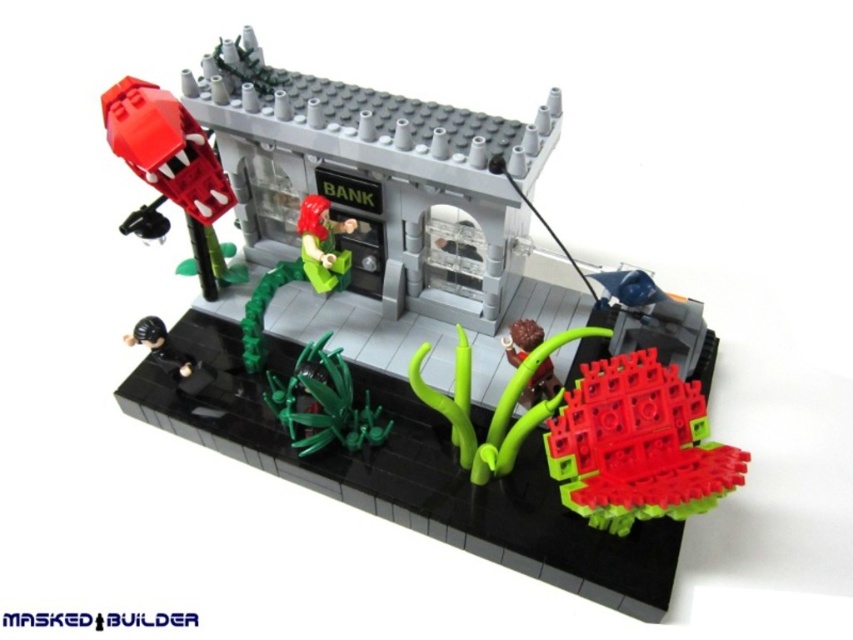
Question: Which object is farther from the camera taking this photo?

Choices:
 (A) matte red robot at upper left
 (B) translucent red plastic plant at lower right
 (C) green matte figure at center

Answer: (C)

Question: Is translucent red plastic plant at lower right smaller than green matte figure at center?

Choices:
 (A) yes
 (B) no

Answer: (A)

Question: Which point is farther to the camera?

Choices:
 (A) translucent red plastic plant at lower right
 (B) matte red robot at upper left
 (C) green matte figure at center
 (D) green matte plant at center

Answer: (C)

Question: Does translucent red plastic plant at lower right appear on the left side of green matte figure at center?

Choices:
 (A) no
 (B) yes

Answer: (A)

Question: Is translucent red plastic plant at lower right further to camera compared to green matte figure at center?

Choices:
 (A) yes
 (B) no

Answer: (B)

Question: Which point is farther from the camera taking this photo?

Choices:
 (A) (346, 412)
 (B) (554, 460)
 (C) (213, 188)

Answer: (A)